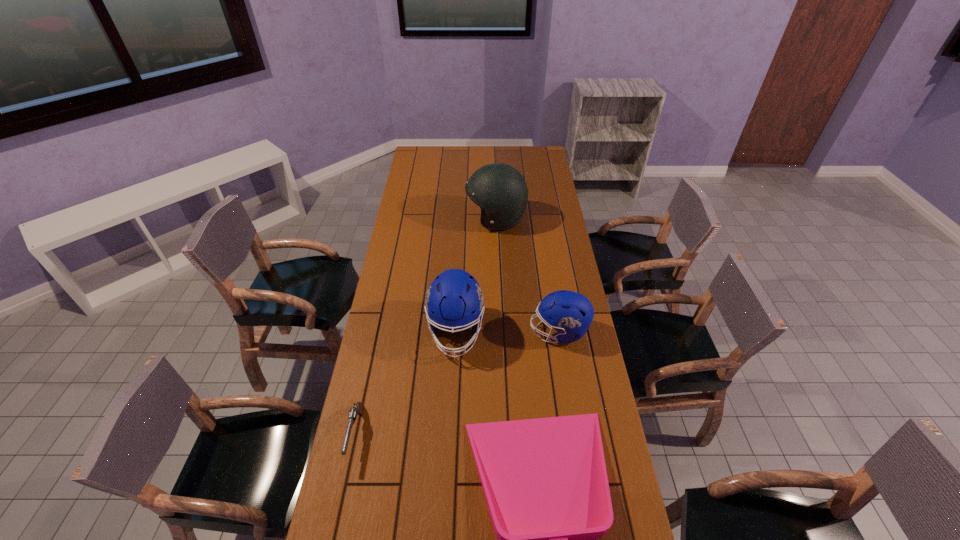
This screenshot has height=540, width=960. I want to click on the third closest object relative to the leftmost object, so click(x=570, y=313).

Where is `football helmet that is the third nearest to the dustpan`? Image resolution: width=960 pixels, height=540 pixels. football helmet that is the third nearest to the dustpan is located at coordinates (500, 190).

Find the location of a particular element. football helmet object that ranks as the closest to the fourth tallest object is located at coordinates (454, 300).

At what (x,y) coordinates should I click in order to perform the action: click on vacant space that satisfies the following two spatial constraints: 1. on the front-facing side of the third tallest object; 2. aiming along the barrel of the leftmost object. Please return your answer as a coordinate pair (x, y). Image resolution: width=960 pixels, height=540 pixels. Looking at the image, I should click on (575, 434).

The width and height of the screenshot is (960, 540). Find the location of `free space that satisfies the following two spatial constraints: 1. at the face opening of the farthest object; 2. aiming along the barrel of the gun`. free space that satisfies the following two spatial constraints: 1. at the face opening of the farthest object; 2. aiming along the barrel of the gun is located at coordinates (505, 434).

Identify the location of free space in the image that satisfies the following two spatial constraints: 1. at the face opening of the farthest object; 2. aiming along the barrel of the second shortest object. (505, 434).